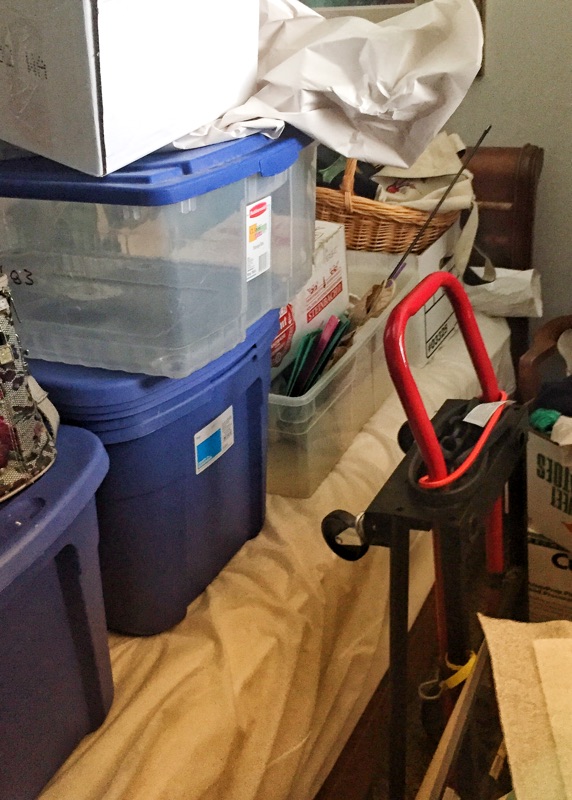
Locate an element on the screen. white sheet style surface covering is located at coordinates (239, 630).